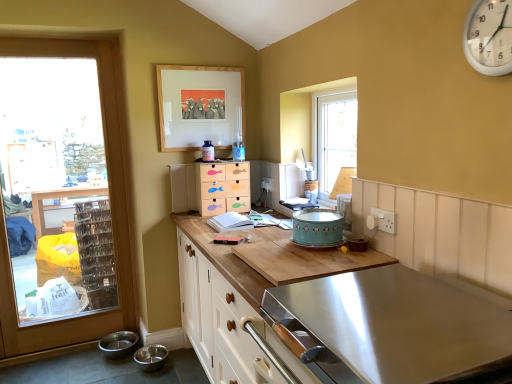
You are a GUI agent. You are given a task and a screenshot of the screen. Output one action in this format:
    pyautogui.click(x=<x>, y=<y>)
    Task: Click on the empty space that is ontop of wooden cutting board at center, the 1th countertop in the bottom-to-top sequence (from a real-world perspective)
    The width and height of the screenshot is (512, 384).
    Given the screenshot: What is the action you would take?
    pyautogui.click(x=260, y=236)